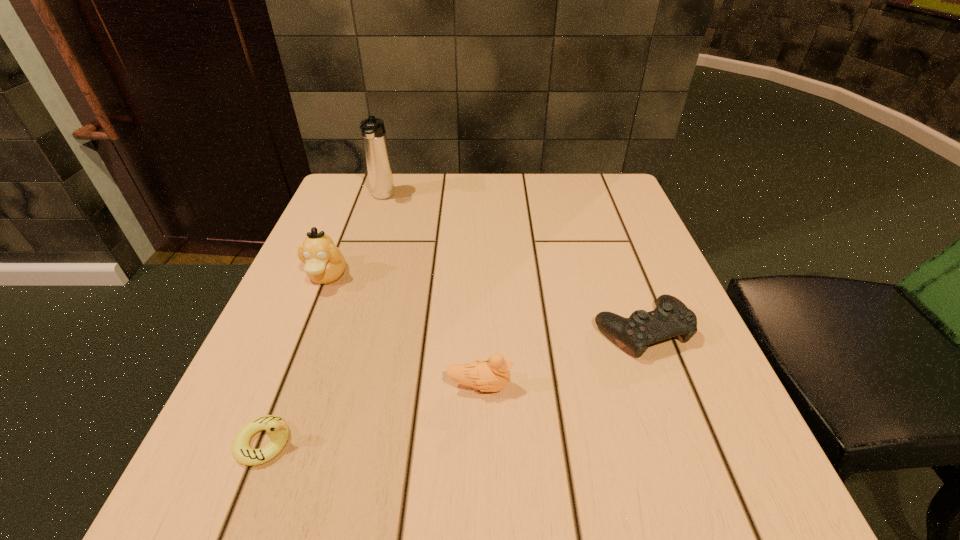
At what (x,y) coordinates should I click in order to perform the action: click on the third closest duckling to the control. Please return your answer as a coordinate pair (x, y). Looking at the image, I should click on (277, 429).

Identify the location of free spot that satisfies the following two spatial constraints: 1. on the face of the fourth shortest object; 2. on the right side of the third nearest object. This screenshot has height=540, width=960. (305, 330).

Locate an element on the screen. This screenshot has height=540, width=960. free region that satisfies the following two spatial constraints: 1. on the handle side of the tallest object; 2. on the left side of the control is located at coordinates (340, 330).

At what (x,y) coordinates should I click in order to perform the action: click on vacant space that satisfies the following two spatial constraints: 1. on the handle side of the control; 2. on the right side of the thermos bottle. Please return your answer as a coordinate pair (x, y). The image size is (960, 540). Looking at the image, I should click on (340, 330).

This screenshot has height=540, width=960. In order to click on vacant space that satisfies the following two spatial constraints: 1. on the face of the third farthest object; 2. on the left side of the tallest duckling in this screenshot , I will do `click(305, 330)`.

I want to click on free space that satisfies the following two spatial constraints: 1. on the handle side of the tallest object; 2. on the left side of the third nearest object, so click(x=340, y=330).

I want to click on free space that satisfies the following two spatial constraints: 1. on the handle side of the tallest object; 2. on the left side of the control, so pos(340,330).

Locate an element on the screen. The width and height of the screenshot is (960, 540). free space in the image that satisfies the following two spatial constraints: 1. on the handle side of the tallest object; 2. on the right side of the rightmost object is located at coordinates (340, 330).